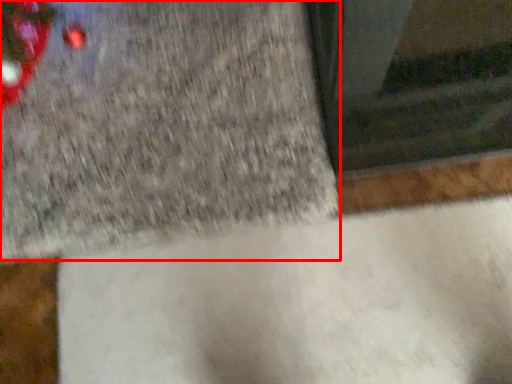
Question: Where is concrete (annotated by the red box) located in relation to concrete in the image?

Choices:
 (A) left
 (B) right

Answer: (A)